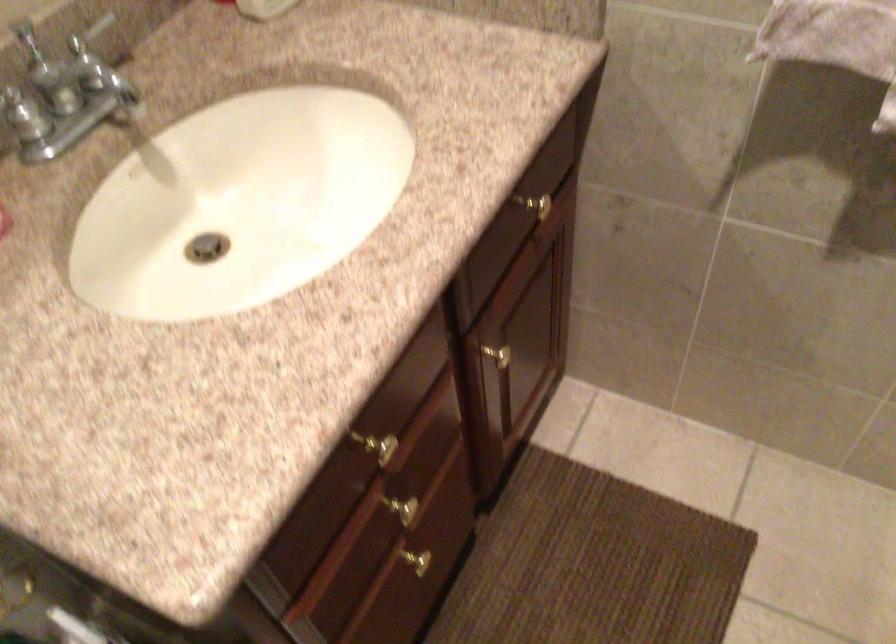
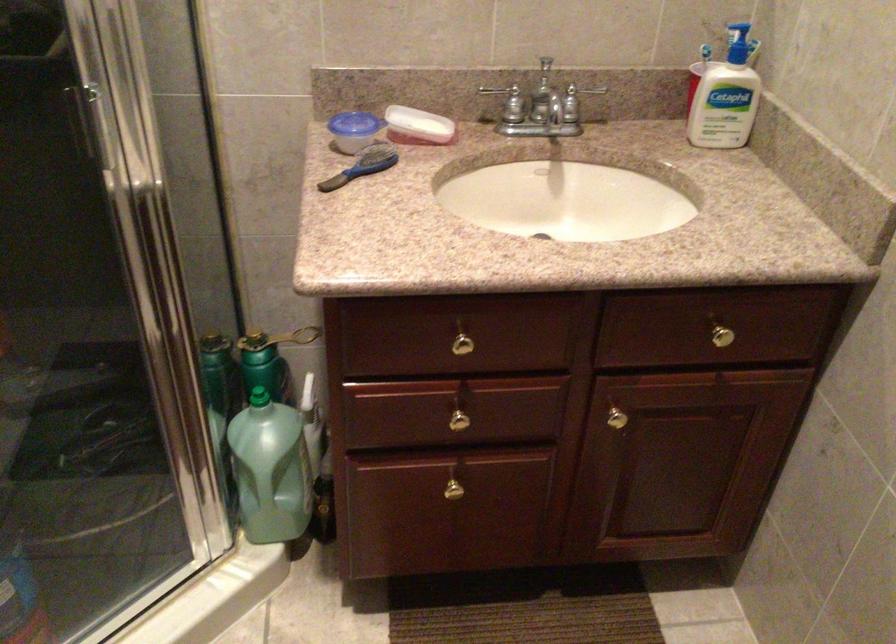
The point at [481,353] is marked in the first image. Where is the corresponding point in the second image?

(612, 411)